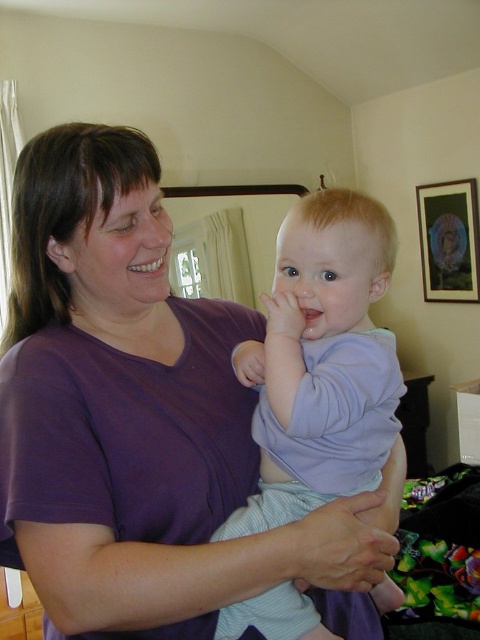
Question: Is purple cotton shirt at center to the left of light blue cotton baby at center from the viewer's perspective?

Choices:
 (A) no
 (B) yes

Answer: (B)

Question: Can you confirm if light blue cotton baby at center is positioned to the left of wooden frame at upper right?

Choices:
 (A) yes
 (B) no

Answer: (A)

Question: Which is nearer to the purple cotton shirt at center?

Choices:
 (A) wooden frame at upper right
 (B) light blue cotton baby at center

Answer: (B)

Question: Is purple cotton shirt at center positioned in front of wooden frame at upper right?

Choices:
 (A) no
 (B) yes

Answer: (B)

Question: Which of the following is the farthest from the observer?

Choices:
 (A) purple cotton shirt at center
 (B) wooden frame at upper right
 (C) light blue cotton baby at center

Answer: (B)

Question: Which object is closer to the camera taking this photo?

Choices:
 (A) wooden frame at upper right
 (B) purple cotton shirt at center

Answer: (B)